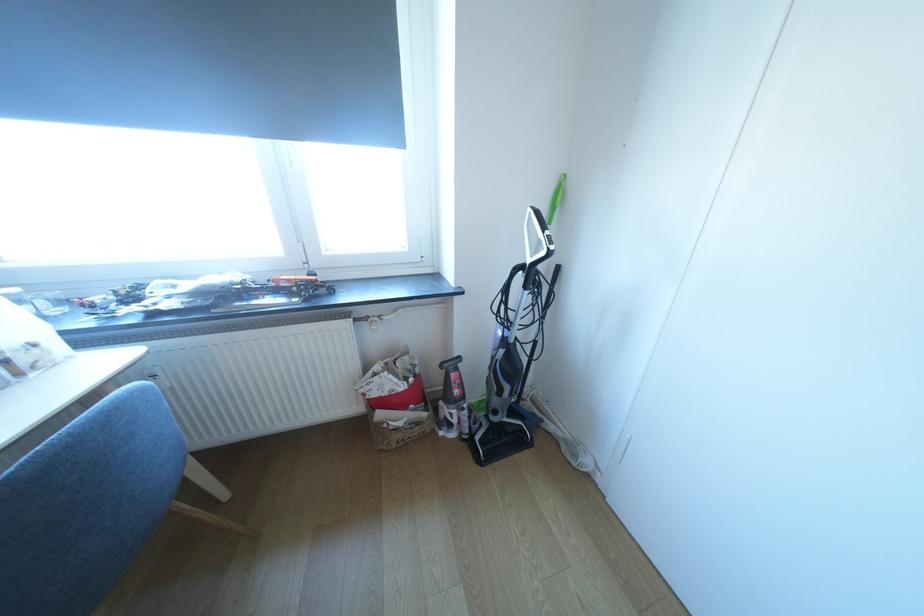
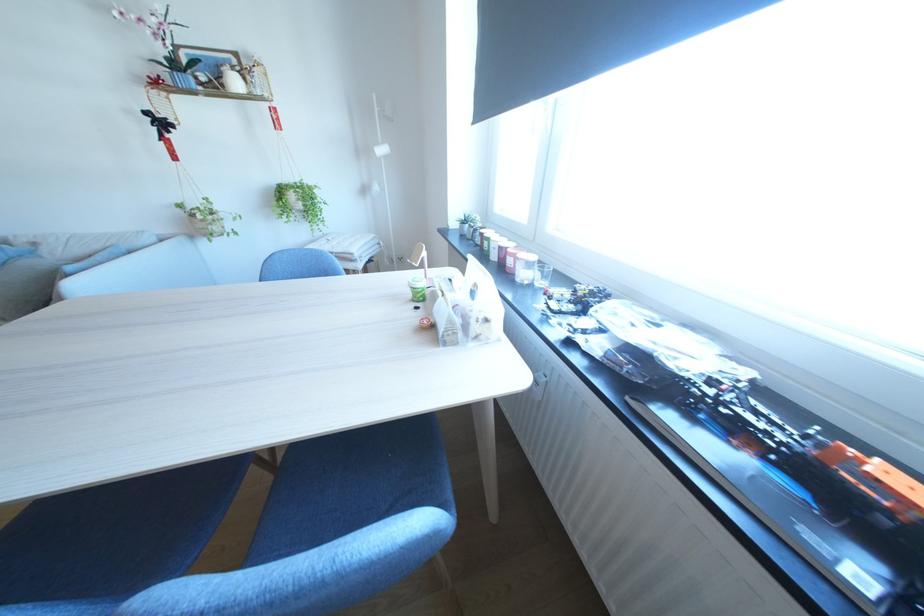
First-person continuous shooting, in which direction is the camera rotating?

The camera's rotation is toward left-down.